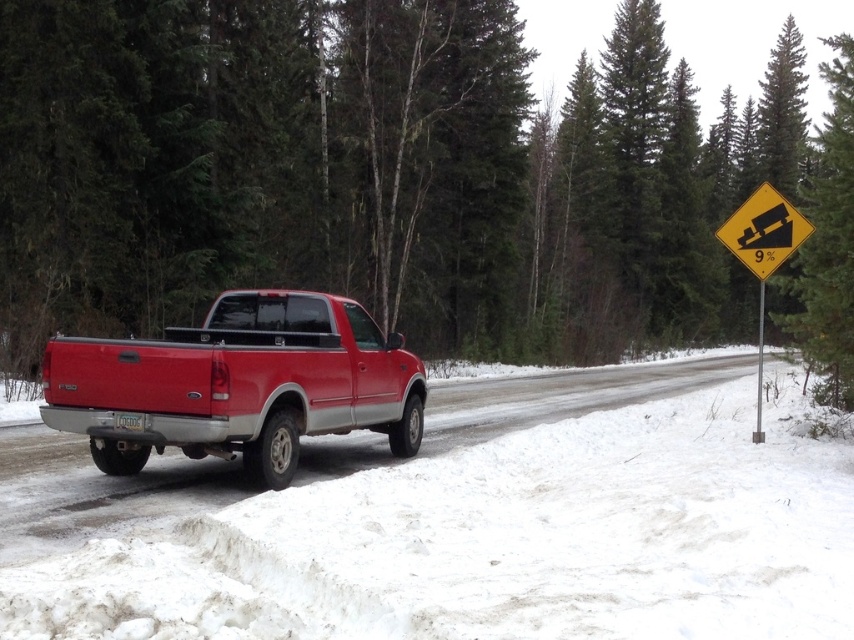
Who is more distant from viewer, (342, 433) or (781, 259)?

The point (781, 259) is behind.

Which is above, shiny red pickup truck at center or yellow reflective diamond at upper right?

yellow reflective diamond at upper right

Between point (117, 410) and point (758, 256), which one is positioned behind?

Positioned behind is point (758, 256).

The width and height of the screenshot is (854, 640). What are the coordinates of `shiny red pickup truck at center` in the screenshot? It's located at click(x=238, y=385).

Who is taller, green matte tree at center or white powdery snow at lower center?

green matte tree at center

This screenshot has height=640, width=854. What do you see at coordinates (402, 177) in the screenshot?
I see `green matte tree at center` at bounding box center [402, 177].

Identify the location of green matte tree at center. This screenshot has height=640, width=854. (402, 177).

Who is lower down, shiny red pickup truck at center or yellow reflective diamond at right?

shiny red pickup truck at center is lower down.

Describe the element at coordinates (238, 385) in the screenshot. I see `shiny red pickup truck at center` at that location.

The height and width of the screenshot is (640, 854). What do you see at coordinates (238, 385) in the screenshot? I see `shiny red pickup truck at center` at bounding box center [238, 385].

I want to click on shiny red pickup truck at center, so click(x=238, y=385).